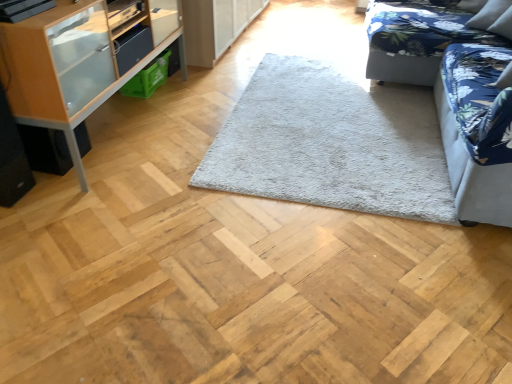
Question: From the image's perspective, is matte black drawer at upper left above or below wooden cabinet at left?

Choices:
 (A) below
 (B) above

Answer: (B)

Question: Is matte black drawer at upper left spatially inside wooden cabinet at left, or outside of it?

Choices:
 (A) inside
 (B) outside

Answer: (A)

Question: Which is nearer to the blue floral fabric couch at upper right, the 2th studio couch positioned from the front?

Choices:
 (A) velvet floral studio couch at right, acting as the second studio couch starting from the back
 (B) gray fluffy rug at center
 (C) wooden cabinet at left
 (D) matte black drawer at upper left

Answer: (A)

Question: Which object is positioned farthest from the matte black drawer at upper left?

Choices:
 (A) gray fluffy rug at center
 (B) blue floral fabric couch at upper right, the first studio couch in the back-to-front sequence
 (C) velvet floral studio couch at right, the first studio couch viewed from the front
 (D) wooden cabinet at left

Answer: (C)